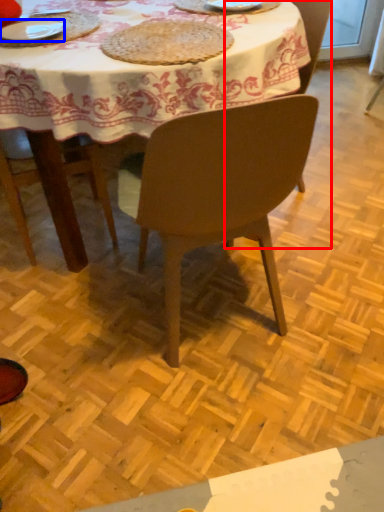
Question: Which object is further to the camera taking this photo, chair (highlighted by a red box) or plate (highlighted by a blue box)?

Choices:
 (A) chair
 (B) plate

Answer: (A)